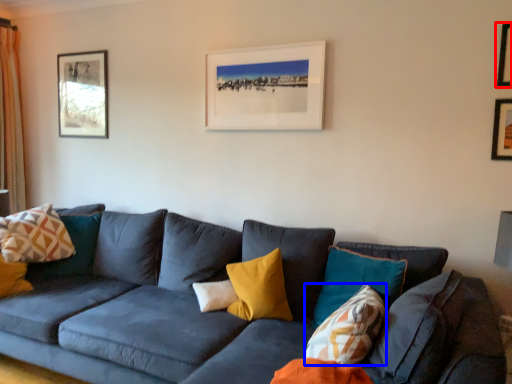
Question: Which object is closer to the camera taking this photo, picture frame (highlighted by a red box) or pillow (highlighted by a blue box)?

Choices:
 (A) picture frame
 (B) pillow

Answer: (B)